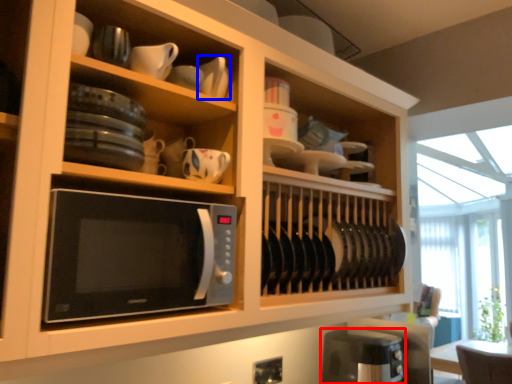
Question: Which point is closer to the camera, appliance (highlighted by a red box) or tableware (highlighted by a blue box)?

Choices:
 (A) appliance
 (B) tableware

Answer: (B)